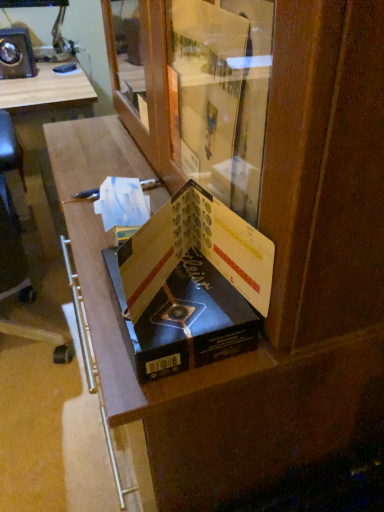
Where is `matte black book at center, which is the 1th paperback book from front to back`? The height and width of the screenshot is (512, 384). matte black book at center, which is the 1th paperback book from front to back is located at coordinates (197, 249).

Describe the element at coordinates (197, 249) in the screenshot. I see `matte black book at center, which is the 1th paperback book from front to back` at that location.

This screenshot has height=512, width=384. Find the location of `matte black book at center, the 2th paperback book from the front`. matte black book at center, the 2th paperback book from the front is located at coordinates (190, 321).

What do you see at coordinates (190, 321) in the screenshot? I see `matte black book at center, the 2th paperback book from the front` at bounding box center [190, 321].

Where is `matte black book at center, marked as the second paperback book in a back-to-front arrangement`? matte black book at center, marked as the second paperback book in a back-to-front arrangement is located at coordinates (197, 249).

Which is more to the left, matte black book at center, the 2th paperback book from the front, or matte black book at center, marked as the second paperback book in a back-to-front arrangement?

matte black book at center, the 2th paperback book from the front.

Looking at this image, is the depth of matte black book at center, which is the first paperback book in back-to-front order, less than that of matte black book at center, marked as the second paperback book in a back-to-front arrangement?

No, matte black book at center, which is the first paperback book in back-to-front order, is further to the viewer.

Which is closer, (164, 350) or (202, 250)?

Point (164, 350) appears to be closer to the viewer than point (202, 250).

From the image's perspective, is matte black book at center, which is the first paperback book in back-to-front order, located above or below matte black book at center, which is the 1th paperback book from front to back?

Based on their image positions, matte black book at center, which is the first paperback book in back-to-front order, is located beneath matte black book at center, which is the 1th paperback book from front to back.

From a real-world perspective, who is located higher, matte black book at center, the 2th paperback book from the front, or matte black book at center, which is the 1th paperback book from front to back?

matte black book at center, which is the 1th paperback book from front to back, is physically above.

Between matte black book at center, which is the first paperback book in back-to-front order, and matte black book at center, marked as the second paperback book in a back-to-front arrangement, which one has larger width?

Wider between the two is matte black book at center, which is the first paperback book in back-to-front order.

Between matte black book at center, the 2th paperback book from the front, and matte black book at center, marked as the second paperback book in a back-to-front arrangement, which one has less height?

With less height is matte black book at center, the 2th paperback book from the front.

In terms of size, does matte black book at center, which is the first paperback book in back-to-front order, appear bigger or smaller than matte black book at center, which is the 1th paperback book from front to back?

matte black book at center, which is the first paperback book in back-to-front order, is smaller than matte black book at center, which is the 1th paperback book from front to back.

Can matte black book at center, marked as the second paperback book in a back-to-front arrangement, be found inside matte black book at center, which is the first paperback book in back-to-front order?

No.

Is matte black book at center, the 2th paperback book from the front, not close to matte black book at center, which is the 1th paperback book from front to back?

No, matte black book at center, the 2th paperback book from the front, is not far away from matte black book at center, which is the 1th paperback book from front to back.

Is matte black book at center, which is the first paperback book in back-to-front order, oriented away from matte black book at center, which is the 1th paperback book from front to back?

No, matte black book at center, which is the first paperback book in back-to-front order,'s orientation is not away from matte black book at center, which is the 1th paperback book from front to back.

Find the location of a particular element. Image resolution: width=384 pixels, height=512 pixels. paperback book in front of the matte black book at center, the 2th paperback book from the front is located at coordinates (197, 249).

Is matte black book at center, marked as the second paperback book in a back-to-front arrangement, at the right side of matte black book at center, the 2th paperback book from the front?

Indeed, matte black book at center, marked as the second paperback book in a back-to-front arrangement, is positioned on the right side of matte black book at center, the 2th paperback book from the front.

Is matte black book at center, which is the 1th paperback book from front to back, in front of or behind matte black book at center, the 2th paperback book from the front, in the image?

matte black book at center, which is the 1th paperback book from front to back, is positioned closer to the viewer than matte black book at center, the 2th paperback book from the front.

Which is less distant, [224,256] or [165,322]?

Point [224,256].

From the image's perspective, which is below, matte black book at center, which is the 1th paperback book from front to back, or matte black book at center, which is the first paperback book in back-to-front order?

matte black book at center, which is the first paperback book in back-to-front order, from the image's perspective.

From a real-world perspective, is matte black book at center, marked as the second paperback book in a back-to-front arrangement, on top of matte black book at center, which is the first paperback book in back-to-front order?

Yes, from a real-world perspective, matte black book at center, marked as the second paperback book in a back-to-front arrangement, is above matte black book at center, which is the first paperback book in back-to-front order.

Considering the sizes of matte black book at center, marked as the second paperback book in a back-to-front arrangement, and matte black book at center, which is the first paperback book in back-to-front order, in the image, is matte black book at center, marked as the second paperback book in a back-to-front arrangement, wider or thinner than matte black book at center, which is the first paperback book in back-to-front order,?

A: Clearly, matte black book at center, marked as the second paperback book in a back-to-front arrangement, has less width compared to matte black book at center, which is the first paperback book in back-to-front order.

Considering the relative sizes of matte black book at center, which is the 1th paperback book from front to back, and matte black book at center, the 2th paperback book from the front, in the image provided, is matte black book at center, which is the 1th paperback book from front to back, taller than matte black book at center, the 2th paperback book from the front,?

Correct, matte black book at center, which is the 1th paperback book from front to back, is much taller as matte black book at center, the 2th paperback book from the front.

Who is bigger, matte black book at center, marked as the second paperback book in a back-to-front arrangement, or matte black book at center, which is the first paperback book in back-to-front order?

matte black book at center, marked as the second paperback book in a back-to-front arrangement.

Looking at this image, would you say matte black book at center, which is the 1th paperback book from front to back, is inside or outside matte black book at center, which is the first paperback book in back-to-front order?

matte black book at center, which is the 1th paperback book from front to back, cannot be found inside matte black book at center, which is the first paperback book in back-to-front order.

Are matte black book at center, marked as the second paperback book in a back-to-front arrangement, and matte black book at center, which is the first paperback book in back-to-front order, located far from each other?

Actually, matte black book at center, marked as the second paperback book in a back-to-front arrangement, and matte black book at center, which is the first paperback book in back-to-front order, are a little close together.

Does matte black book at center, marked as the second paperback book in a back-to-front arrangement, turn towards matte black book at center, the 2th paperback book from the front?

No, matte black book at center, marked as the second paperback book in a back-to-front arrangement, is not turned towards matte black book at center, the 2th paperback book from the front.

Locate an element on the screen. Image resolution: width=384 pixels, height=512 pixels. paperback book in front of the matte black book at center, which is the first paperback book in back-to-front order is located at coordinates (197, 249).

Locate an element on the screen. The width and height of the screenshot is (384, 512). paperback book below the matte black book at center, marked as the second paperback book in a back-to-front arrangement (from a real-world perspective) is located at coordinates (190, 321).

Find the location of a particular element. This screenshot has height=512, width=384. paperback book on the left of the matte black book at center, which is the 1th paperback book from front to back is located at coordinates (190, 321).